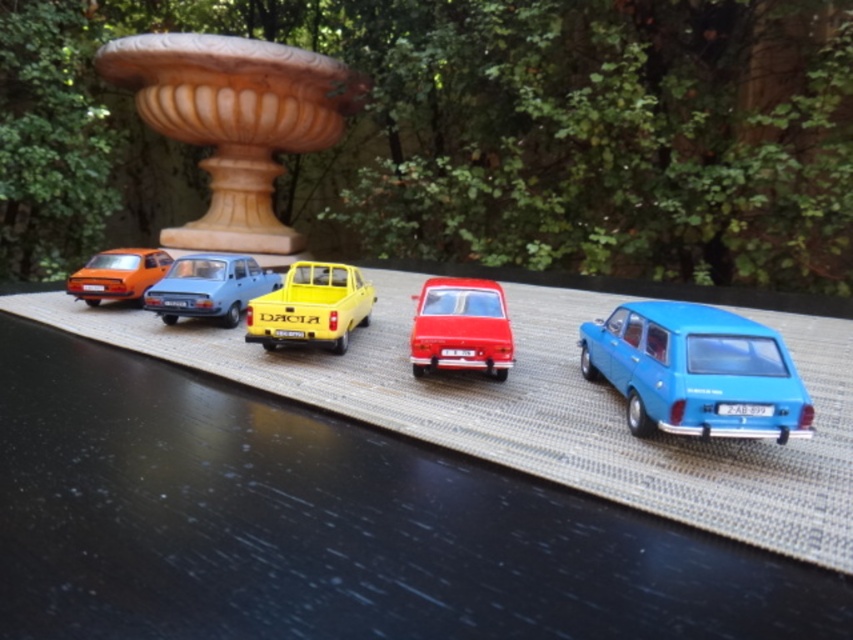
Does point (433, 312) come farther from viewer compared to point (135, 248)?

No, (433, 312) is in front of (135, 248).

Can you confirm if glossy red sedan at center is thinner than matte orange car at left?

Indeed, glossy red sedan at center has a lesser width compared to matte orange car at left.

Who is more distant from viewer, (448, 292) or (109, 250)?

Point (109, 250)

Locate an element on the screen. The width and height of the screenshot is (853, 640). glossy red sedan at center is located at coordinates (460, 326).

Does blue matte station wagon at right have a lesser width compared to glossy red sedan at center?

In fact, blue matte station wagon at right might be wider than glossy red sedan at center.

Does blue matte station wagon at right appear on the left side of glossy red sedan at center?

Incorrect, blue matte station wagon at right is not on the left side of glossy red sedan at center.

Locate an element on the screen. blue matte station wagon at right is located at coordinates click(x=695, y=371).

Can you confirm if yellow matte pickup truck at center is wider than matte orange car at left?

Yes, yellow matte pickup truck at center is wider than matte orange car at left.

Which is more to the right, yellow matte pickup truck at center or matte orange car at left?

yellow matte pickup truck at center

Who is more forward, (326,289) or (90,278)?

Point (326,289) is more forward.

I want to click on yellow matte pickup truck at center, so click(311, 307).